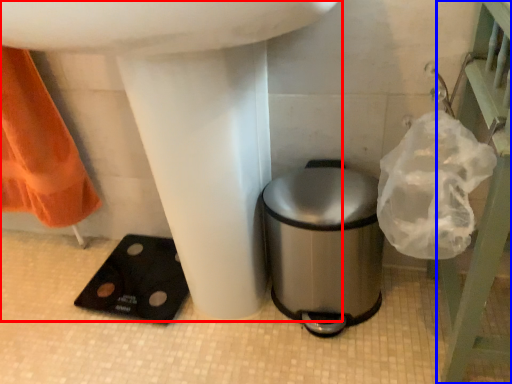
Question: Which point is further to the camera, sink (highlighted by a red box) or balustrade (highlighted by a blue box)?

Choices:
 (A) sink
 (B) balustrade

Answer: (B)